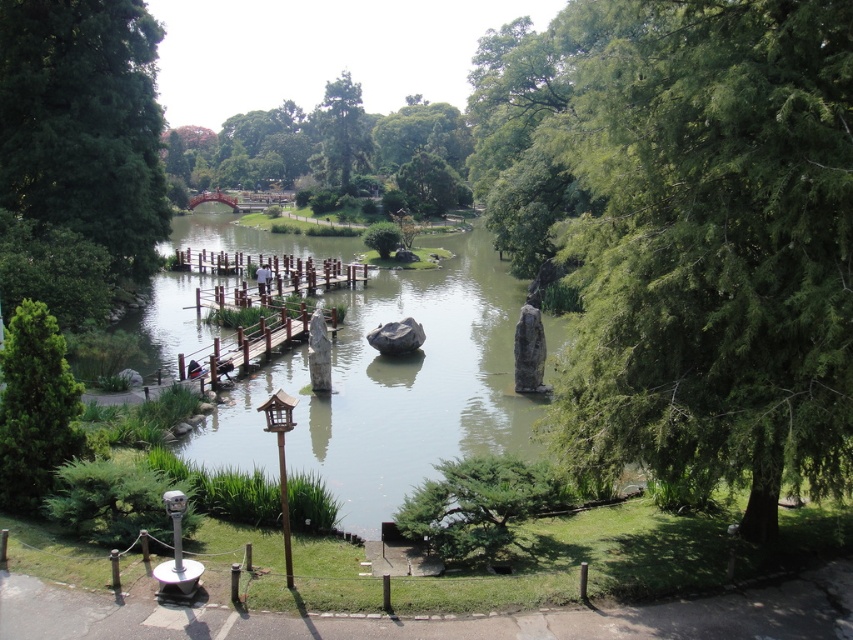
Who is shorter, wooden dock at center or shiny red bridge at center?

With less height is wooden dock at center.

Who is more forward, (310, 312) or (234, 204)?

Positioned in front is point (310, 312).

Is point (264, 332) positioned before point (253, 208)?

Yes, it is in front of point (253, 208).

Where is `wooden dock at center`? The height and width of the screenshot is (640, 853). wooden dock at center is located at coordinates (260, 340).

Between green leafy tree at left and brown wooden dock at center, which one has less height?

Standing shorter between the two is brown wooden dock at center.

Between point (137, 22) and point (231, 269), which one is positioned behind?

The point (231, 269) is behind.

Locate an element on the screen. The image size is (853, 640). green leafy tree at left is located at coordinates (84, 122).

Does point (18, 374) come behind point (329, 106)?

That is False.

Can you confirm if green leafy tree at lower left is smaller than green textured tree at center?

Correct, green leafy tree at lower left occupies less space than green textured tree at center.

Is point (10, 509) positioned before point (343, 168)?

Yes.

The width and height of the screenshot is (853, 640). I want to click on green leafy tree at lower left, so click(35, 408).